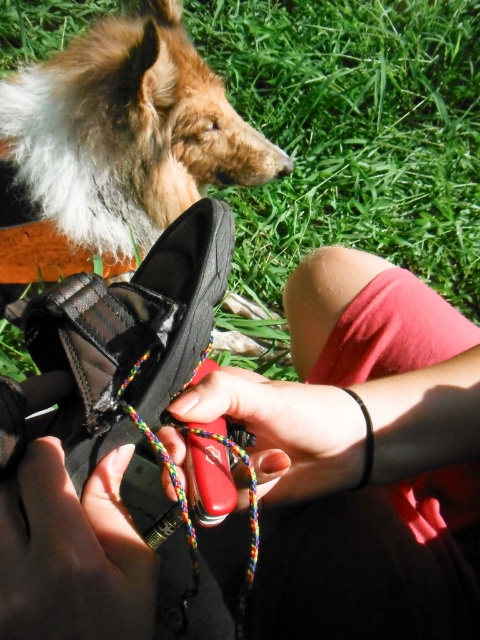
Question: Based on their relative distances, which object is nearer to the green grass at upper center?

Choices:
 (A) black rubber wristband at lower center
 (B) rubber shoe at lower center
 (C) matte black shoe at lower left

Answer: (B)

Question: Which object appears farthest from the camera in this image?

Choices:
 (A) rubber shoe at lower center
 (B) matte black shoe at lower left
 (C) black rubber wristband at lower center
 (D) green grass at upper center

Answer: (D)

Question: Which object is positioned farthest from the green grass at upper center?

Choices:
 (A) rubber shoe at lower center
 (B) black rubber wristband at lower center
 (C) red matte knife at center
 (D) matte black shoe at lower left

Answer: (D)

Question: Can you confirm if rubber shoe at lower center is positioned above green grass at upper center?

Choices:
 (A) yes
 (B) no

Answer: (B)

Question: Does green grass at upper center have a lesser width compared to red matte knife at center?

Choices:
 (A) yes
 (B) no

Answer: (B)

Question: Does red matte knife at center appear under black rubber wristband at lower center?

Choices:
 (A) yes
 (B) no

Answer: (B)